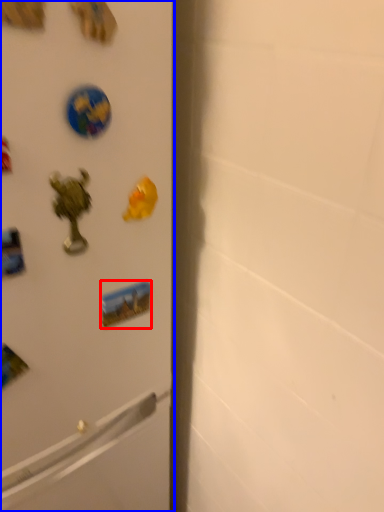
Question: Among these objects, which one is nearest to the camera, sticker (highlighted by a red box) or refrigerator (highlighted by a blue box)?

Choices:
 (A) sticker
 (B) refrigerator

Answer: (B)